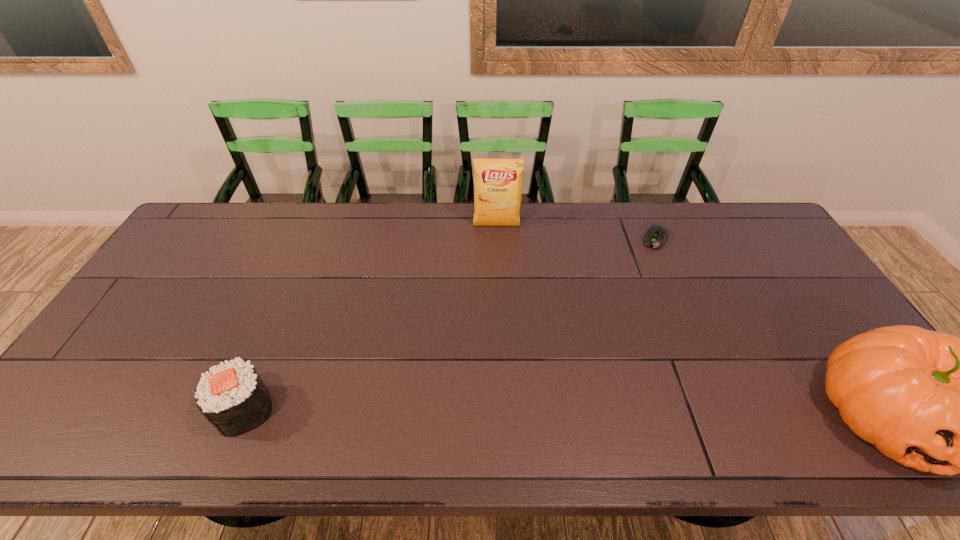
I want to click on blank area located on the wheel side of the shortest object, so click(646, 264).

This screenshot has width=960, height=540. What are the coordinates of `vacant region located 0.100m on the wheel side of the shortest object` in the screenshot? It's located at (645, 267).

At what (x,y) coordinates should I click in order to perform the action: click on crisp (potato chip) that is at the far edge. Please return your answer as a coordinate pair (x, y). The width and height of the screenshot is (960, 540). Looking at the image, I should click on (498, 181).

Where is `computer mouse at the far edge`? Image resolution: width=960 pixels, height=540 pixels. computer mouse at the far edge is located at coordinates (655, 237).

Locate an element on the screen. This screenshot has width=960, height=540. object located at the near edge is located at coordinates (233, 398).

The height and width of the screenshot is (540, 960). I want to click on vacant space at the far edge of the desktop, so click(416, 224).

Identify the location of vacant space at the near edge of the desktop. The height and width of the screenshot is (540, 960). (178, 395).

The width and height of the screenshot is (960, 540). In the image, there is a desktop. What are the coordinates of `vacant space at the left edge` in the screenshot? It's located at (198, 254).

This screenshot has height=540, width=960. In the image, there is a desktop. What are the coordinates of `vacant space at the right edge` in the screenshot? It's located at (796, 311).

The width and height of the screenshot is (960, 540). I want to click on vacant area at the near left corner of the desktop, so click(125, 382).